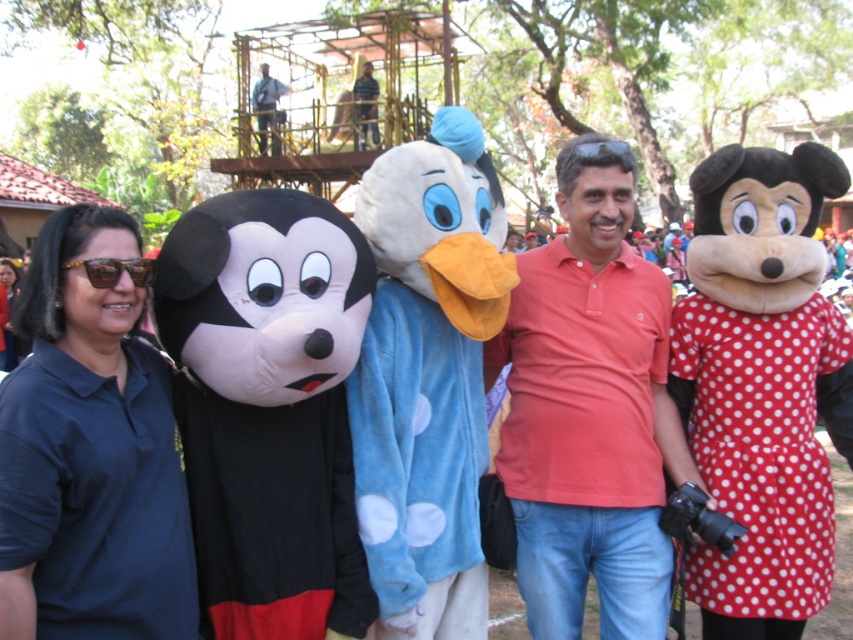
Between dark blue shirt at left and blue plush duck at center, which one appears on the right side from the viewer's perspective?

blue plush duck at center is more to the right.

Based on the photo, is dark blue shirt at left in front of blue plush duck at center?

Yes.

You are a GUI agent. You are given a task and a screenshot of the screen. Output one action in this format:
    pyautogui.click(x=<x>, y=<y>)
    Task: Click on the dark blue shirt at left
    Image resolution: width=853 pixels, height=640 pixels.
    Given the screenshot: What is the action you would take?
    pyautogui.click(x=90, y=449)

Locate an element on the screen. The width and height of the screenshot is (853, 640). dark blue shirt at left is located at coordinates (90, 449).

Between matte red shirt at center and blue plush duck at center, which one has less height?

blue plush duck at center is shorter.

Can you confirm if matte red shirt at center is taller than blue plush duck at center?

Indeed, matte red shirt at center has a greater height compared to blue plush duck at center.

Identify the location of matte red shirt at center. The height and width of the screenshot is (640, 853). (589, 410).

Find the location of a particular element. This screenshot has width=853, height=640. matte red shirt at center is located at coordinates (589, 410).

Find the location of a particular element. This screenshot has height=640, width=853. black plush mickey mouse head at left is located at coordinates (268, 406).

Does point (310, 291) lie behind point (276, 106)?

That is False.

Locate an element on the screen. black plush mickey mouse head at left is located at coordinates (268, 406).